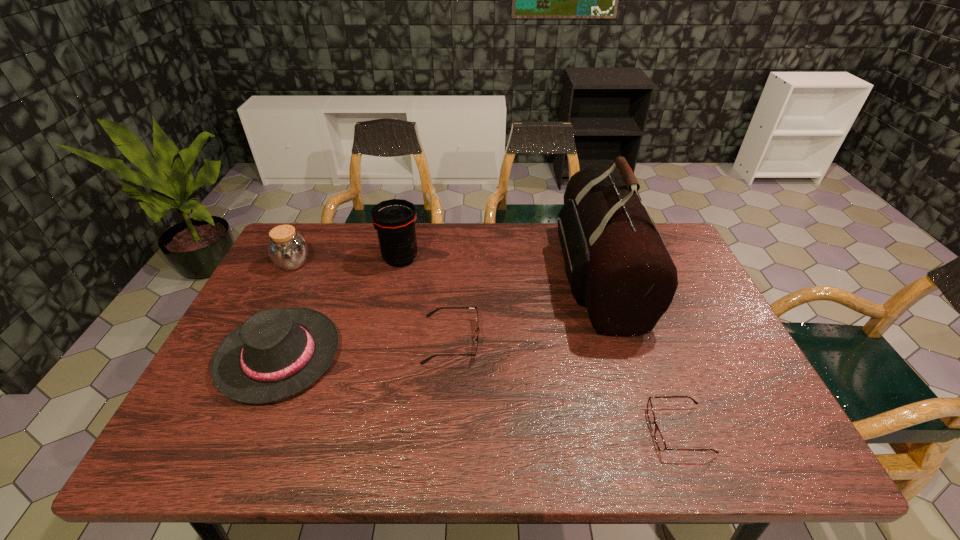
Locate an element on the screen. This screenshot has height=540, width=960. vacant region at the left edge of the desktop is located at coordinates (301, 290).

This screenshot has width=960, height=540. In the image, there is a desktop. In order to click on free region at the right edge in this screenshot , I will do `click(698, 372)`.

Identify the location of free spot between the dress hat and the duffel bag. The height and width of the screenshot is (540, 960). (439, 316).

This screenshot has width=960, height=540. Identify the location of vacant area that lies between the nearer spectacles and the dress hat. (479, 393).

The height and width of the screenshot is (540, 960). Find the location of `free space between the dress hat and the farther spectacles`. free space between the dress hat and the farther spectacles is located at coordinates (366, 348).

Find the location of `vacant space that's between the dress hat and the duffel bag`. vacant space that's between the dress hat and the duffel bag is located at coordinates (439, 316).

At what (x,y) coordinates should I click in order to perform the action: click on empty location between the third object from left to right and the dress hat. Please return your answer as a coordinate pair (x, y). The width and height of the screenshot is (960, 540). Looking at the image, I should click on (340, 307).

In order to click on free space that is in between the left spectacles and the nearer spectacles in this screenshot , I will do `click(565, 385)`.

Find the location of a particular element. unoccupied position between the taller spectacles and the shortest object is located at coordinates (565, 385).

At what (x,y) coordinates should I click in order to perform the action: click on empty location between the dress hat and the fourth object from left to right. Please return your answer as a coordinate pair (x, y). Looking at the image, I should click on (366, 348).